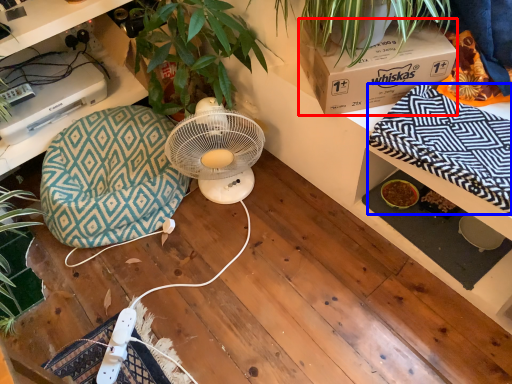
Question: Which object is further to the camera taking this photo, box (highlighted by a red box) or blanket (highlighted by a blue box)?

Choices:
 (A) box
 (B) blanket

Answer: (A)